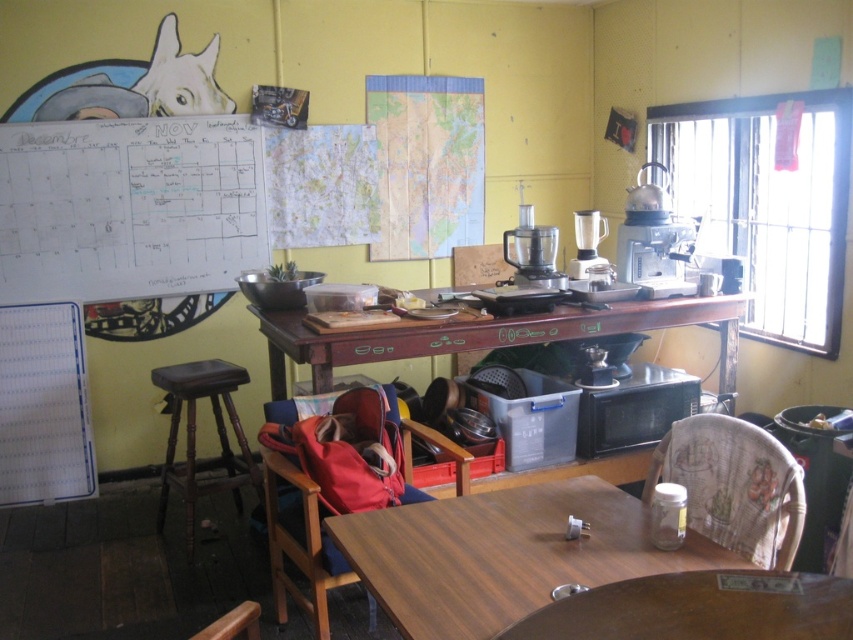
You are sitting in the red fabric chair at center and want to reach the wooden table at center to grab a coffee mug. Which direction should you move to reach the table?

The red fabric chair at center is to the left of the wooden table at center, so you should move to the right to reach the table.

You are a barista preparing drinks in the kitchen. You need to move the coffee machine closer to the wooden table to make it easier to access. How much distance do you need to cover to move the satin silver coffee machine at upper right to the wooden table at center?

The wooden table at center is 18.10 inches from the satin silver coffee machine at upper right, so you need to move the satin silver coffee machine at upper right 18.10 inches towards the wooden table at center to place it closer.